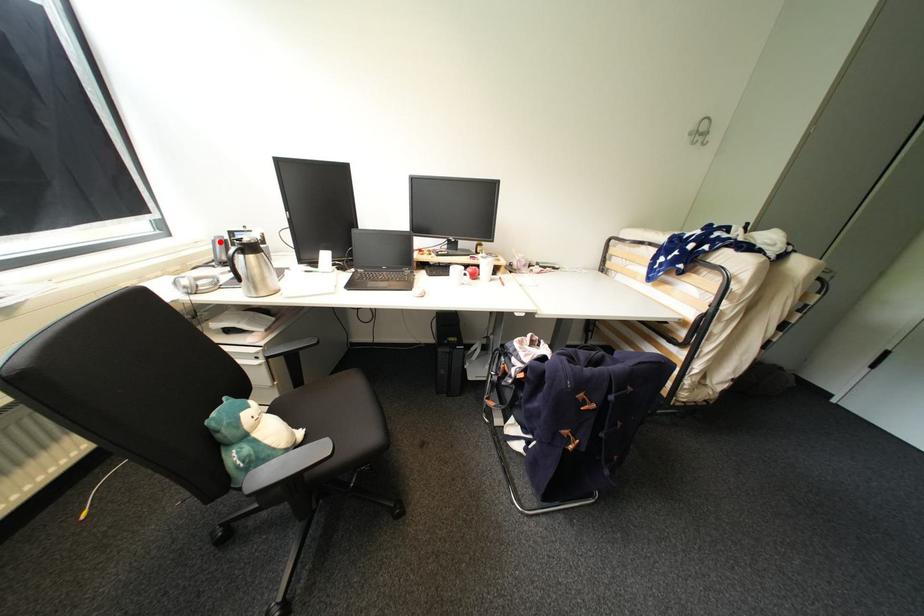
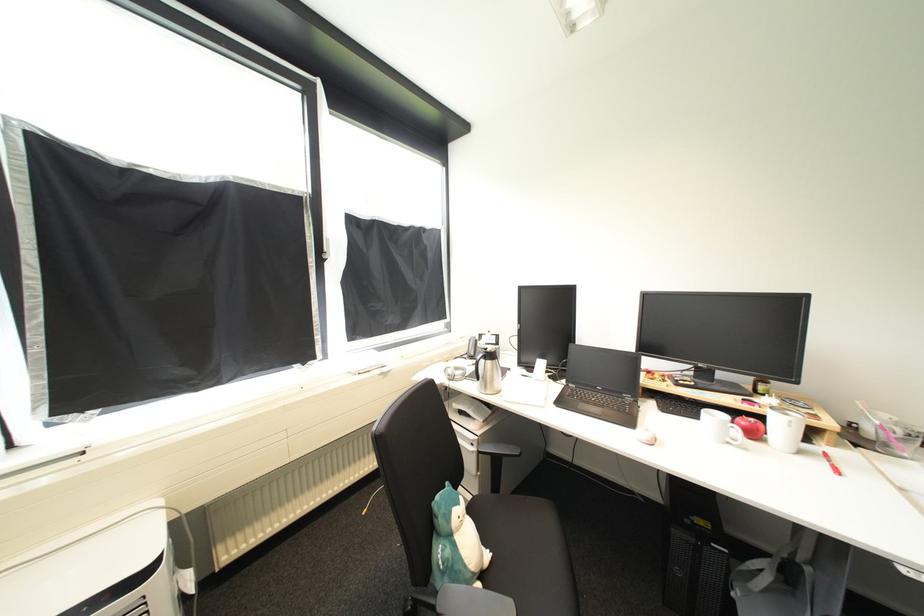
Find the pixel in the second image that matches the highlighted location in the first image.

(477, 341)